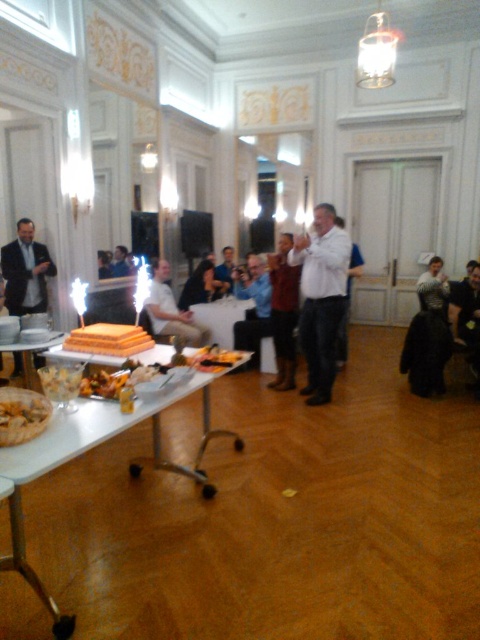
You are standing at the entrance of the room and want to locate the white shirt at center. According to the coordinates provided, where would you find it?

The white shirt at center is located at the coordinates point [321,298].

You are a photographer at the wedding reception and want to capture a closeup of both the point at (264, 280) and the point at (104, 342). Since you can only focus on one point at a time, which point should you focus on to ensure both points are in focus?

You should focus on the point at (104, 342) because it is closer to the camera than the point at (264, 280). By focusing on the closer point, the depth of field will likely include the farther point as well, ensuring both are in focus.